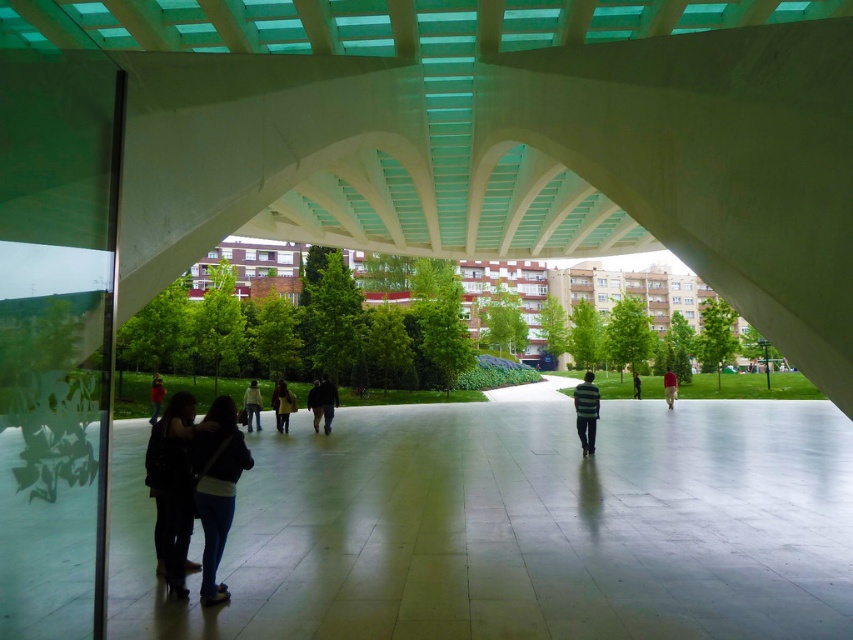
Does dark gray fabric coat at lower left have a lesser height compared to striped sweater at center?

Yes.

Is dark gray fabric coat at lower left positioned behind striped sweater at center?

No, dark gray fabric coat at lower left is in front of striped sweater at center.

Where is `dark gray fabric coat at lower left`? The height and width of the screenshot is (640, 853). dark gray fabric coat at lower left is located at coordinates (172, 488).

The image size is (853, 640). I want to click on dark gray fabric coat at lower left, so click(x=172, y=488).

Does tan fabric pants at center appear on the right side of dark blue jeans at center?

Correct, you'll find tan fabric pants at center to the right of dark blue jeans at center.

From the picture: Is tan fabric pants at center wider than dark blue jeans at center?

Indeed, tan fabric pants at center has a greater width compared to dark blue jeans at center.

Which is in front, point (672, 372) or point (636, 388)?

Point (636, 388) is more forward.

The width and height of the screenshot is (853, 640). I want to click on tan fabric pants at center, so click(x=669, y=387).

Which of these two, dark gray fabric jacket at center or tan fabric pants at center, stands taller?

tan fabric pants at center

Find the location of a particular element. Image resolution: width=853 pixels, height=640 pixels. dark gray fabric jacket at center is located at coordinates (328, 401).